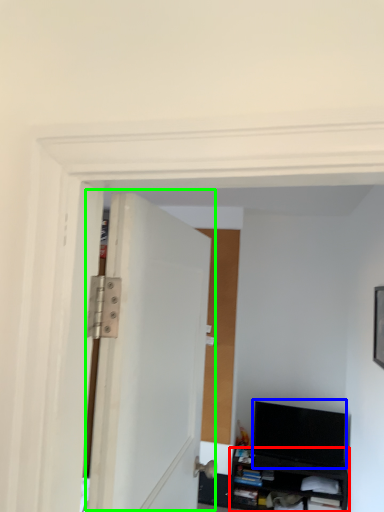
Question: Which object is the farthest from cabinetry (highlighted by a red box)? Choose among these: computer monitor (highlighted by a blue box) or door (highlighted by a green box).

Choices:
 (A) computer monitor
 (B) door

Answer: (B)